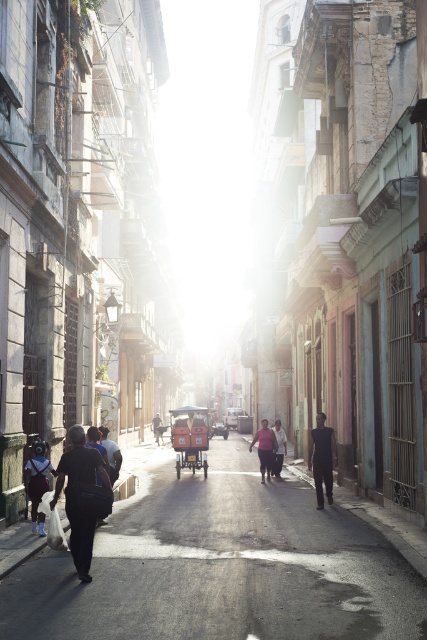
Question: Which object is closer to the camera taking this photo?

Choices:
 (A) dark gray fabric shirt at center
 (B) dark blue fabric bag at lower left
 (C) metallic silver car at center

Answer: (B)

Question: Estimate the real-world distances between objects in this image. Which object is farther from the matte black backpack at lower left?

Choices:
 (A) matte black cart at center
 (B) black matte jacket at lower left
 (C) dark skin textured pants at center

Answer: (C)

Question: In this image, where is pink matte shirt at center located relative to dark gray fabric bag at center?

Choices:
 (A) right
 (B) left

Answer: (A)

Question: Where is pink matte shirt at center located in relation to dark skin textured pants at center in the image?

Choices:
 (A) above
 (B) below

Answer: (A)

Question: Can you confirm if dark gray fabric bag at center is positioned above metallic silver car at center?

Choices:
 (A) yes
 (B) no

Answer: (A)

Question: Based on their relative distances, which object is nearer to the matte black cart at center?

Choices:
 (A) dark blue fabric bag at lower left
 (B) black matte jacket at lower left

Answer: (B)